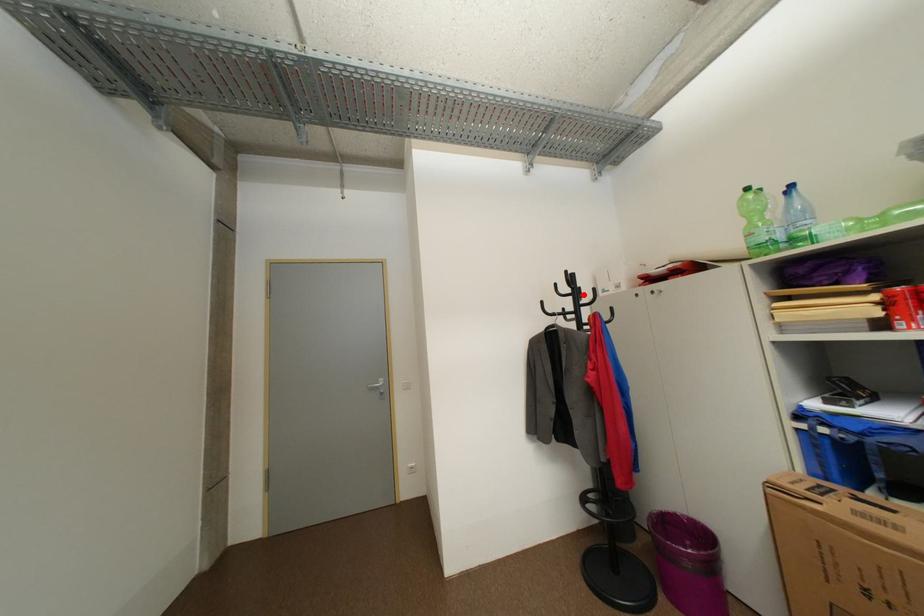
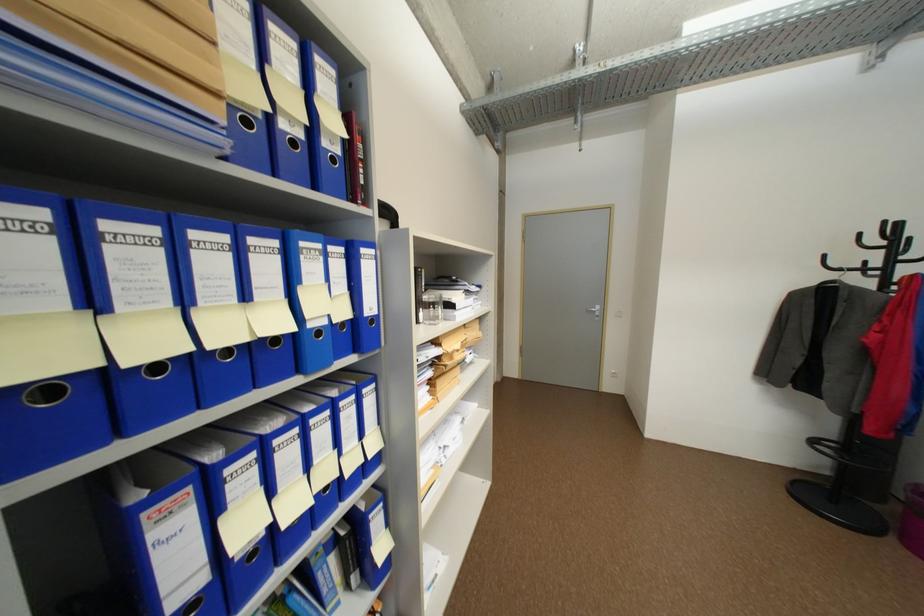
In the second image, find the point that corresponds to the highlighted location in the first image.

(902, 248)